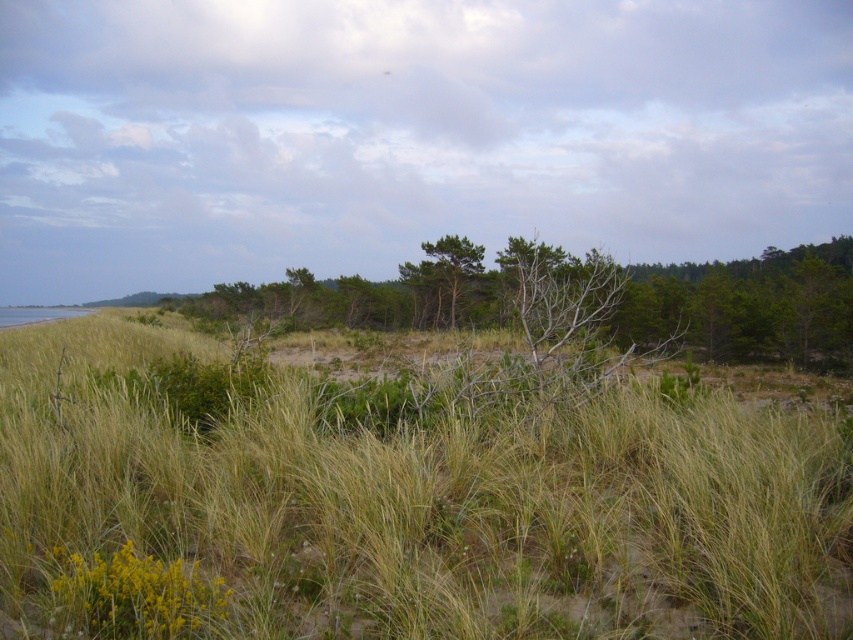
Question: Is green grassy at center positioned before green matte tree at center?

Choices:
 (A) yes
 (B) no

Answer: (A)

Question: Which of the following is the farthest from the observer?

Choices:
 (A) (699, 340)
 (B) (219, 515)

Answer: (A)

Question: Which object is closer to the camera taking this photo?

Choices:
 (A) green matte tree at center
 (B) green grassy at center

Answer: (B)

Question: Where is green grassy at center located in relation to green matte tree at center in the image?

Choices:
 (A) left
 (B) right

Answer: (A)

Question: Which point is farther to the camera?

Choices:
 (A) green grassy at center
 (B) green matte tree at center

Answer: (B)

Question: From the image, what is the correct spatial relationship of green grassy at center in relation to green matte tree at center?

Choices:
 (A) above
 (B) below

Answer: (B)